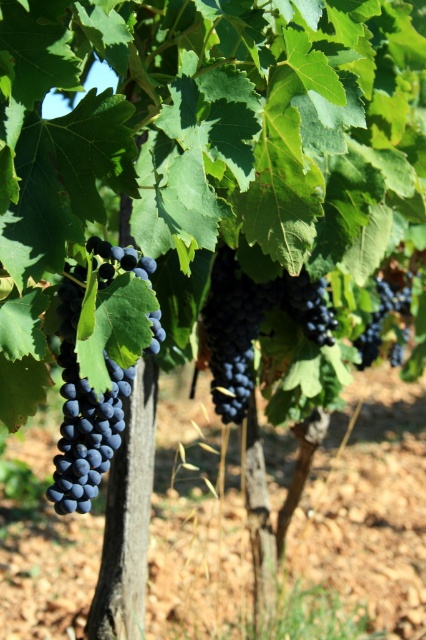
You are a wine producer inspecting grapes in a vineyard. You observe both shiny dark purple grapes at center and dark matte grapes at center. Which type of grape has a greater width?

The shiny dark purple grapes at center have a greater width than the dark matte grapes at center according to the description.